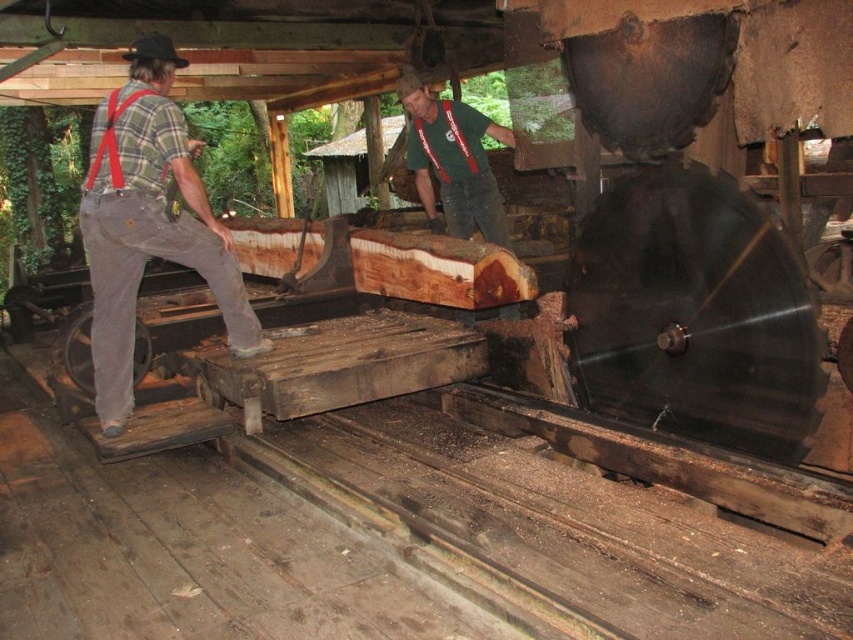
Can you confirm if plaid flannel shirt at left is positioned above green fabric shirt at center?

No, plaid flannel shirt at left is not above green fabric shirt at center.

Is point (119, 106) closer to viewer compared to point (454, 179)?

Yes, it is.

Between point (178, 216) and point (433, 154), which one is positioned behind?

The point (433, 154) is more distant.

Where is `plaid flannel shirt at left`? plaid flannel shirt at left is located at coordinates (148, 224).